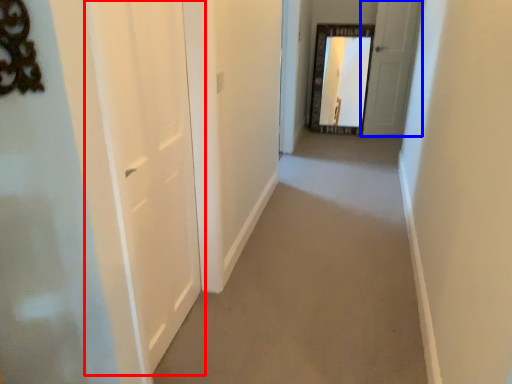
Question: Which of the following is the farthest to the observer, door (highlighted by a red box) or door (highlighted by a blue box)?

Choices:
 (A) door
 (B) door

Answer: (B)